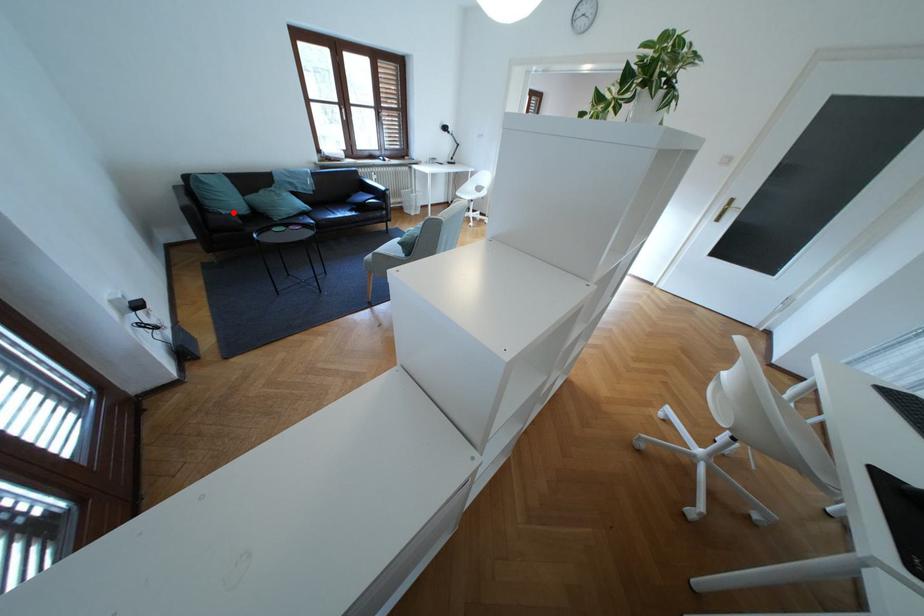
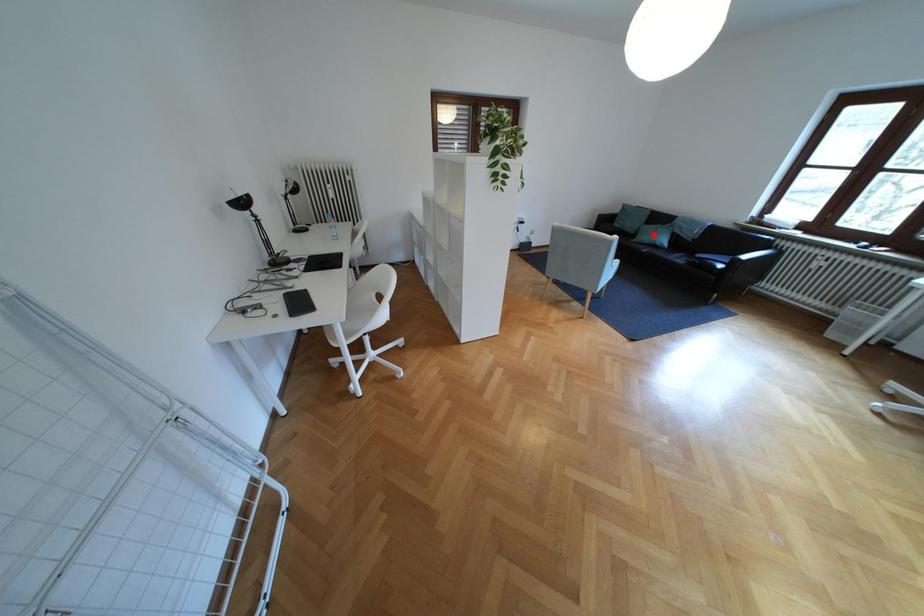
I am providing you with two images of the same scene from different viewpoints. A red point is marked on the first image and another point is marked on the second image. Does the point marked in image1 correspond to the same location as the one in image2?

No